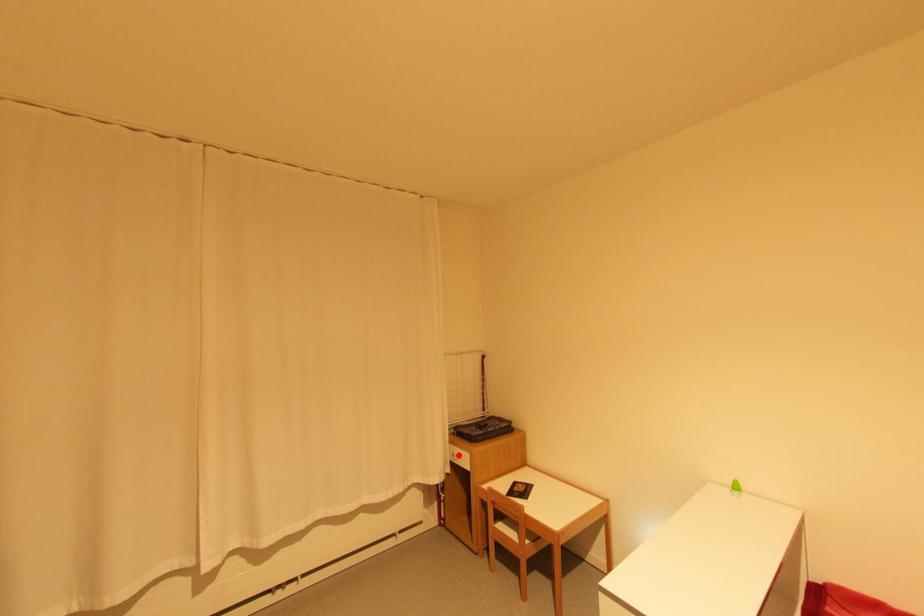
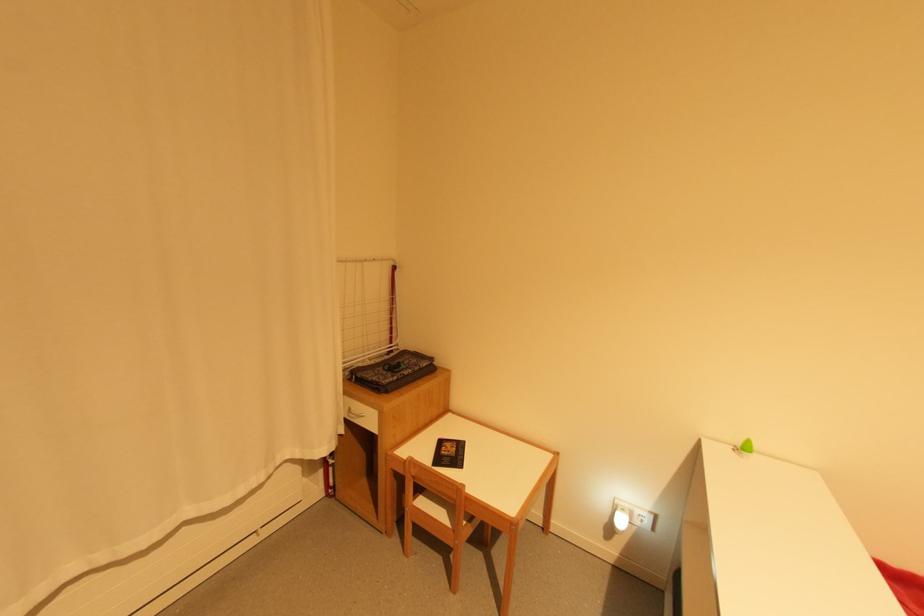
The point at the highlighted location is marked in the first image. Where is the corresponding point in the second image?

(357, 411)